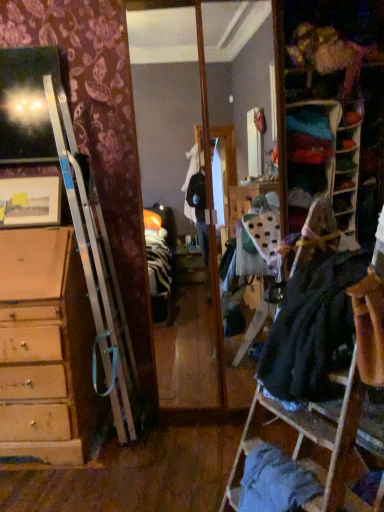
Question: Visually, is velvet fabric bookshelf at upper right positioned to the left or to the right of matte wooden picture frame at upper left?

Choices:
 (A) left
 (B) right

Answer: (B)

Question: Considering the positions of velvet fabric bookshelf at upper right and matte wooden picture frame at upper left in the image, is velvet fabric bookshelf at upper right wider or thinner than matte wooden picture frame at upper left?

Choices:
 (A) thin
 (B) wide

Answer: (A)

Question: Based on their relative distances, which object is nearer to the dark gray fabric dress at right, positioned as the second clothing in bottom-to-top order?

Choices:
 (A) blue cotton shirt at lower right, marked as the second clothing in a top-to-bottom arrangement
 (B) velvet fabric bookshelf at upper right
 (C) matte wooden picture frame at upper left

Answer: (A)

Question: Estimate the real-world distances between objects in this image. Which object is closer to the dark gray fabric dress at right, acting as the first clothing starting from the top?

Choices:
 (A) matte wooden picture frame at upper left
 (B) blue cotton shirt at lower right, marked as the second clothing in a top-to-bottom arrangement
 (C) velvet fabric bookshelf at upper right

Answer: (B)